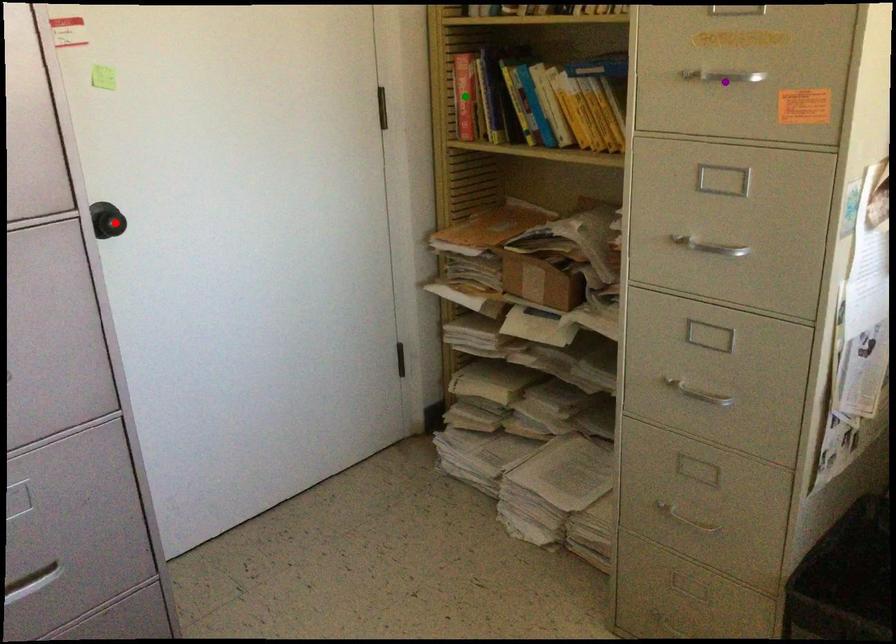
Order these from nearest to farthest:
purple point, green point, red point

purple point
red point
green point